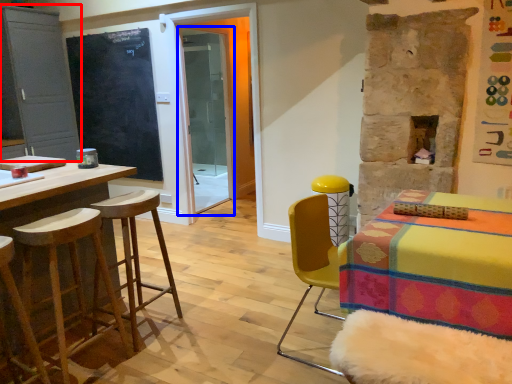
Question: Among these objects, which one is farthest to the camera, cabinetry (highlighted by a red box) or screen door (highlighted by a blue box)?

Choices:
 (A) cabinetry
 (B) screen door

Answer: (B)